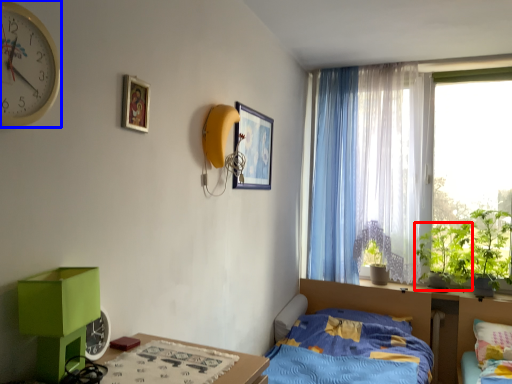
Question: Which object is closer to the camera taking this photo, plant (highlighted by a red box) or clock (highlighted by a blue box)?

Choices:
 (A) plant
 (B) clock

Answer: (B)